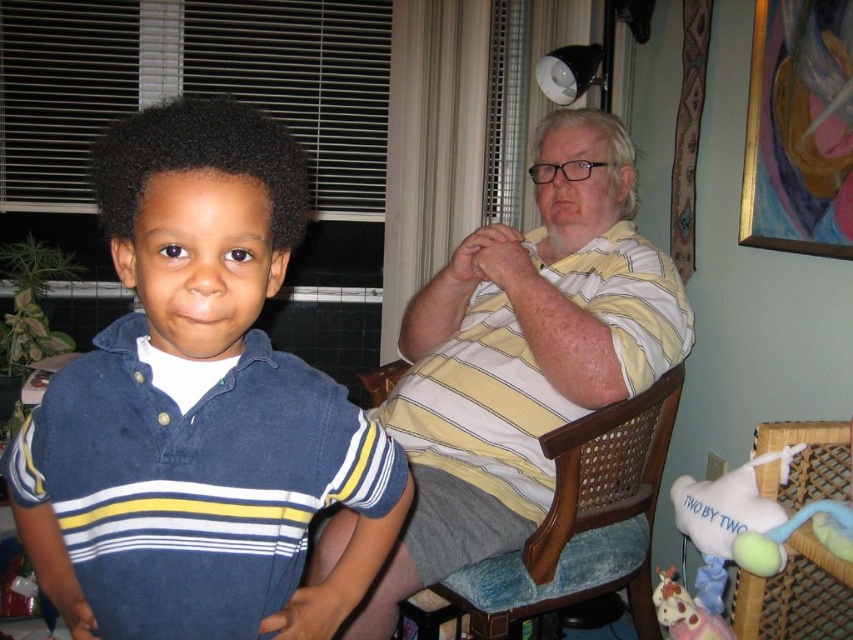
Between white plush toy at lower right and pastel plush unicorn at lower right, which one is positioned higher?

Positioned higher is white plush toy at lower right.

Can you confirm if white plush toy at lower right is taller than pastel plush unicorn at lower right?

Yes.

Image resolution: width=853 pixels, height=640 pixels. I want to click on white plush toy at lower right, so click(x=746, y=515).

Does matte blue shirt at left have a lesser height compared to woven wicker chair at lower right?

No.

Which is more to the right, matte blue shirt at left or woven wicker chair at lower right?

From the viewer's perspective, woven wicker chair at lower right appears more on the right side.

Is point (231, 132) less distant than point (828, 483)?

Yes, it is in front of point (828, 483).

Where is `matte blue shirt at left`? The height and width of the screenshot is (640, 853). matte blue shirt at left is located at coordinates (199, 406).

Can you confirm if yellow striped shirt at center is bigger than wooden at right?

Indeed, yellow striped shirt at center has a larger size compared to wooden at right.

Consider the image. Measure the distance between point (474, 406) and camera.

A distance of 1.70 meters exists between point (474, 406) and camera.

The image size is (853, 640). I want to click on yellow striped shirt at center, so click(521, 356).